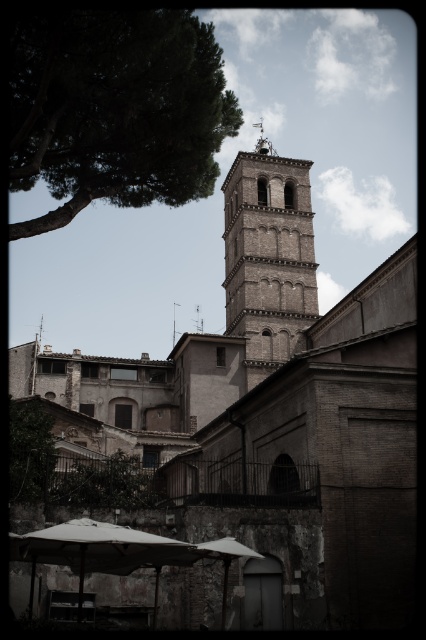
Question: Does green leafy tree at upper left have a greater width compared to brown brick bell tower at center?

Choices:
 (A) yes
 (B) no

Answer: (A)

Question: Is green leafy tree at upper left closer to camera compared to brown brick bell tower at center?

Choices:
 (A) no
 (B) yes

Answer: (B)

Question: Which object appears farthest from the camera in this image?

Choices:
 (A) green leafy tree at upper left
 (B) brown brick bell tower at center

Answer: (B)

Question: Is green leafy tree at upper left above brown brick bell tower at center?

Choices:
 (A) no
 (B) yes

Answer: (A)

Question: Which of the following is the farthest from the observer?

Choices:
 (A) green leafy tree at upper left
 (B) brown brick bell tower at center

Answer: (B)